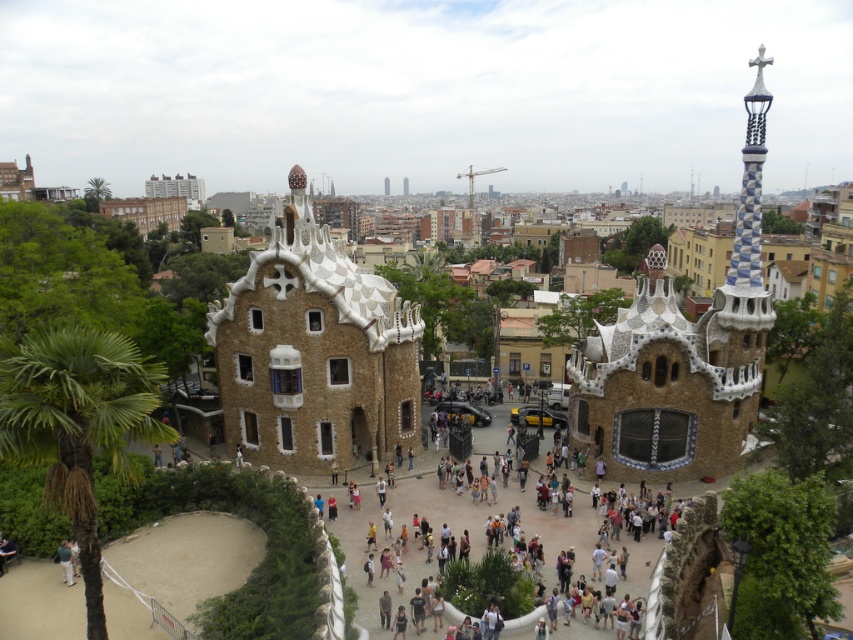
You are a tourist standing at the entrance of Parc Guell and want to take a photo of the white mosaic church at center and the green leafy palm tree at lower left. Which object should you focus on first if you want to capture both in the frame without zooming in or out?

You should focus on the white mosaic church at center first because it is taller than the green leafy palm tree at lower left, so it will appear larger in the frame and require more attention to ensure it fits properly.

You are a tourist standing at the entrance of Parc Gaud? in Barcelona. You see the white mosaic church at center and the green leafy palm tree at lower left. Which object is closer to you?

The white mosaic church at center is closer to you because the green leafy palm tree at lower left is behind it.